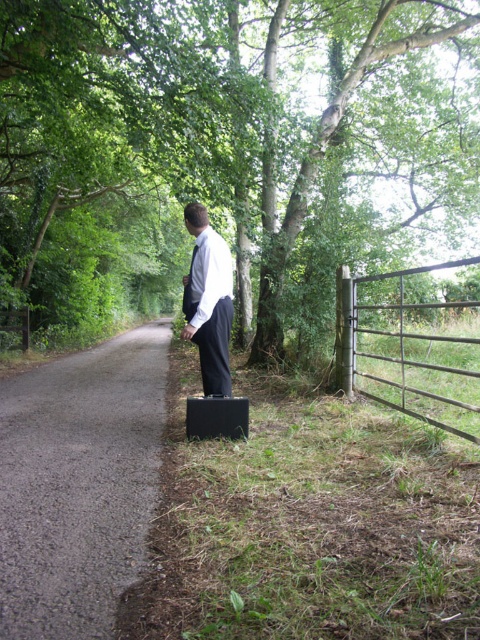
Who is shorter, green leafy tree at center or black matte suitcase at lower center?

black matte suitcase at lower center

Which of these two, green leafy tree at center or black matte suitcase at lower center, stands taller?

Standing taller between the two is green leafy tree at center.

Is point (36, 83) less distant than point (208, 422)?

No, it is not.

In order to click on green leafy tree at center in this screenshot , I will do `click(226, 150)`.

What do you see at coordinates (79, 483) in the screenshot? The height and width of the screenshot is (640, 480). I see `gray asphalt road at center` at bounding box center [79, 483].

Between point (75, 497) and point (400, 355), which one is positioned in front?

Point (75, 497) is more forward.

I want to click on gray asphalt road at center, so click(79, 483).

You are a GUI agent. You are given a task and a screenshot of the screen. Output one action in this format:
    pyautogui.click(x=<x>, y=<y>)
    Task: Click on the green leafy tree at center
    This screenshot has width=480, height=640.
    Given the screenshot: What is the action you would take?
    pyautogui.click(x=226, y=150)

Based on the photo, is green leafy tree at center shorter than white smooth shirt at center?

No.

Between point (10, 109) and point (201, 280), which one is positioned behind?

Positioned behind is point (10, 109).

This screenshot has height=640, width=480. What are the coordinates of `green leafy tree at center` in the screenshot? It's located at pyautogui.click(x=226, y=150).